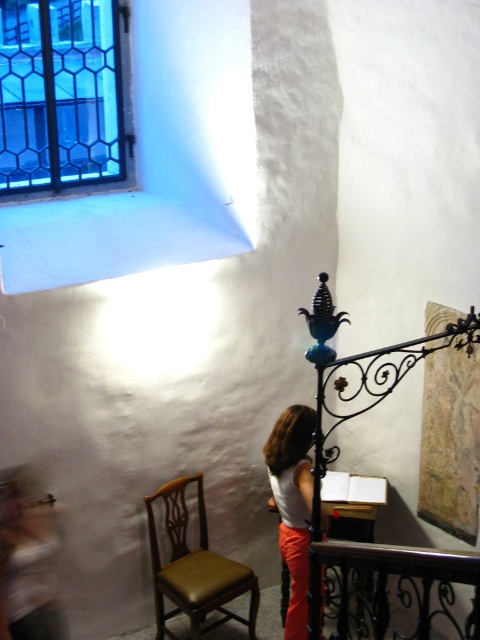
Which is more to the right, black wrought iron balustrade at lower right or orange cotton pants at center?

black wrought iron balustrade at lower right is more to the right.

Does point (372, 602) come closer to viewer compared to point (288, 547)?

No, (372, 602) is behind (288, 547).

The width and height of the screenshot is (480, 640). In order to click on black wrought iron balustrade at lower right in this screenshot , I will do `click(397, 582)`.

Does dark blue glass window at upper left have a smaller size compared to orange cotton pants at center?

No.

Does dark blue glass window at upper left have a lesser height compared to orange cotton pants at center?

No.

Image resolution: width=480 pixels, height=640 pixels. What are the coordinates of `dark blue glass window at upper left` in the screenshot? It's located at (x=60, y=93).

The image size is (480, 640). I want to click on white matte shirt at center, so click(292, 504).

From the picture: Which is more to the right, white matte shirt at center or wooden polished table at center?

From the viewer's perspective, white matte shirt at center appears more on the right side.

Does point (303, 544) come behind point (289, 568)?

No, it is not.

Image resolution: width=480 pixels, height=640 pixels. Identify the location of white matte shirt at center. (292, 504).